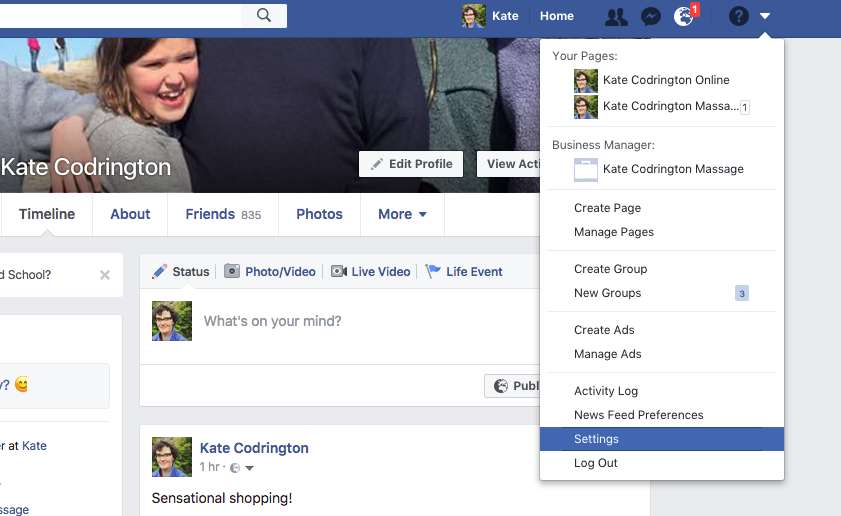
The image size is (841, 516). I want to click on photos, so click(x=453, y=82), click(x=468, y=10), click(x=586, y=91), click(x=583, y=106), click(x=177, y=329), click(x=154, y=459).